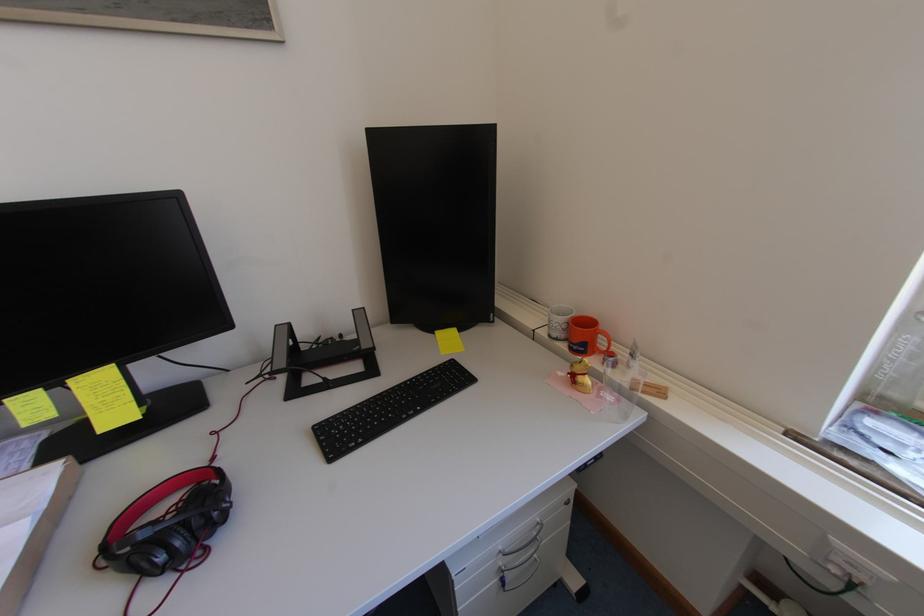
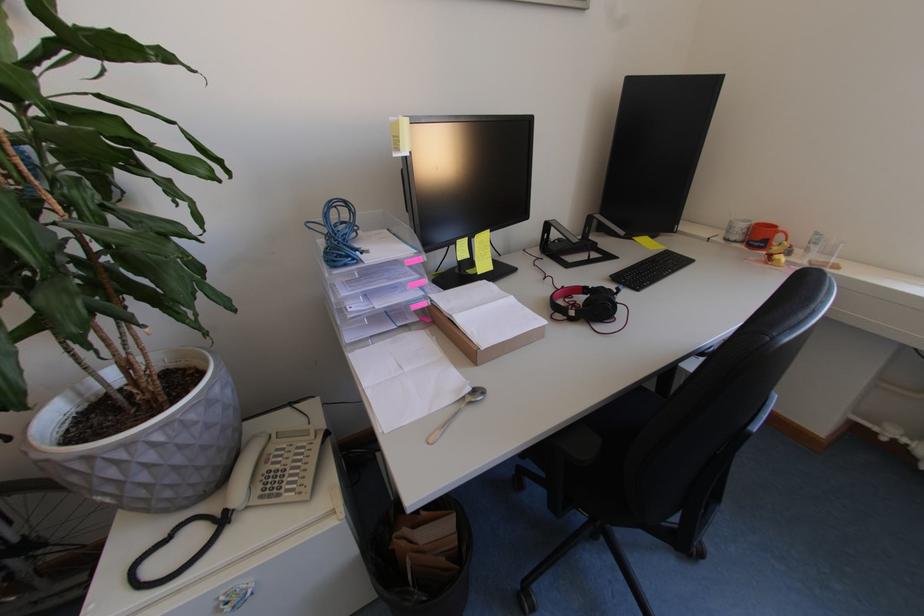
Find the pixel in the second image that matches point 637,368 in the first image.

(816, 253)